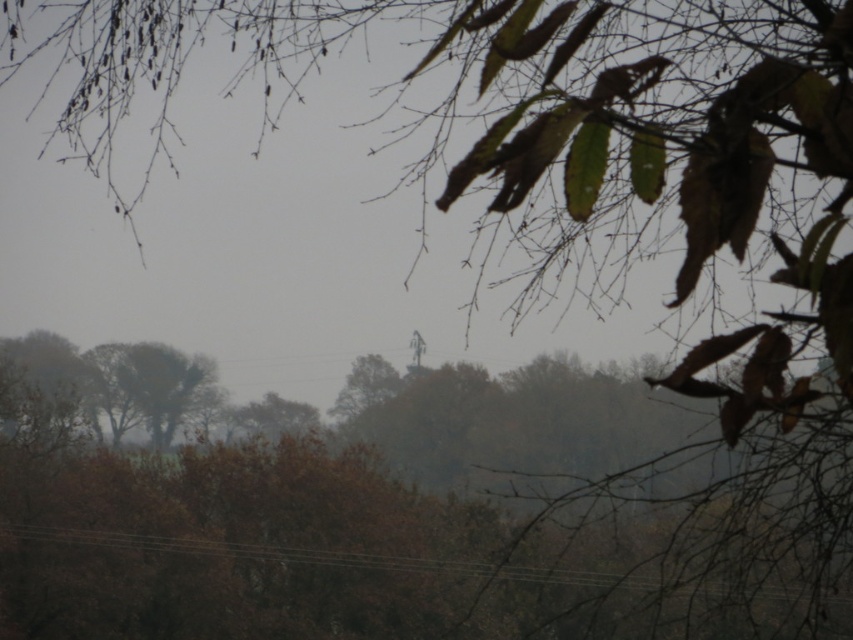
Question: Does brown matte power line at lower center appear over brown textured tree at lower left?

Choices:
 (A) yes
 (B) no

Answer: (B)

Question: Does brown matte power line at lower center have a lesser width compared to brown textured tree at lower left?

Choices:
 (A) no
 (B) yes

Answer: (A)

Question: Is brown matte power line at lower center above brown textured tree at lower left?

Choices:
 (A) no
 (B) yes

Answer: (A)